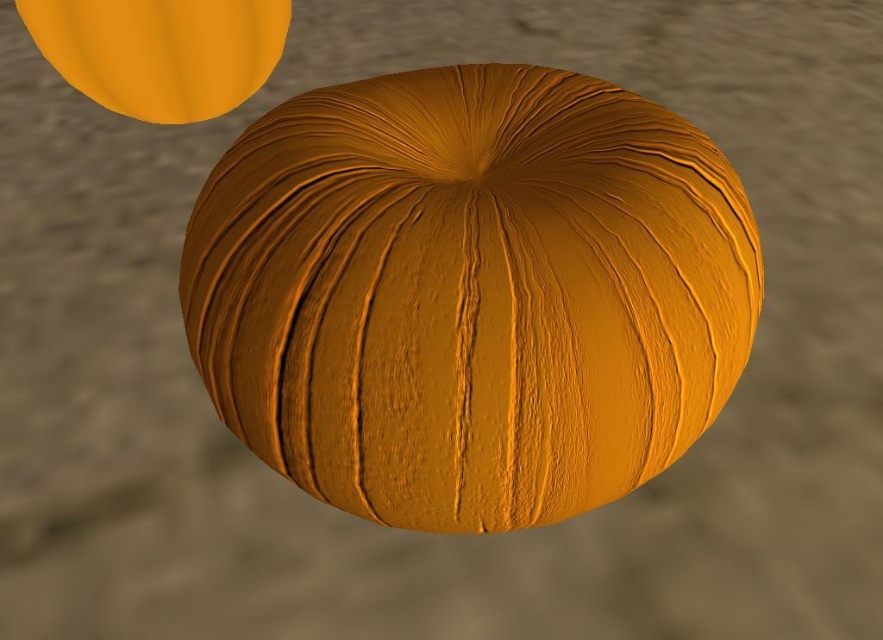
Question: Which point appears closest to the camera in this image?

Choices:
 (A) (239, 76)
 (B) (639, 305)

Answer: (B)

Question: Is matte orange sphere at center smaller than matte orange sphere at upper left?

Choices:
 (A) yes
 (B) no

Answer: (B)

Question: Which point is farther to the camera?

Choices:
 (A) (55, 42)
 (B) (344, 392)

Answer: (A)

Question: Does matte orange sphere at center appear on the left side of matte orange sphere at upper left?

Choices:
 (A) no
 (B) yes

Answer: (A)

Question: Which of the following is the farthest from the observer?

Choices:
 (A) matte orange sphere at center
 (B) matte orange sphere at upper left

Answer: (B)

Question: Can you confirm if matte orange sphere at center is positioned below matte orange sphere at upper left?

Choices:
 (A) no
 (B) yes

Answer: (B)